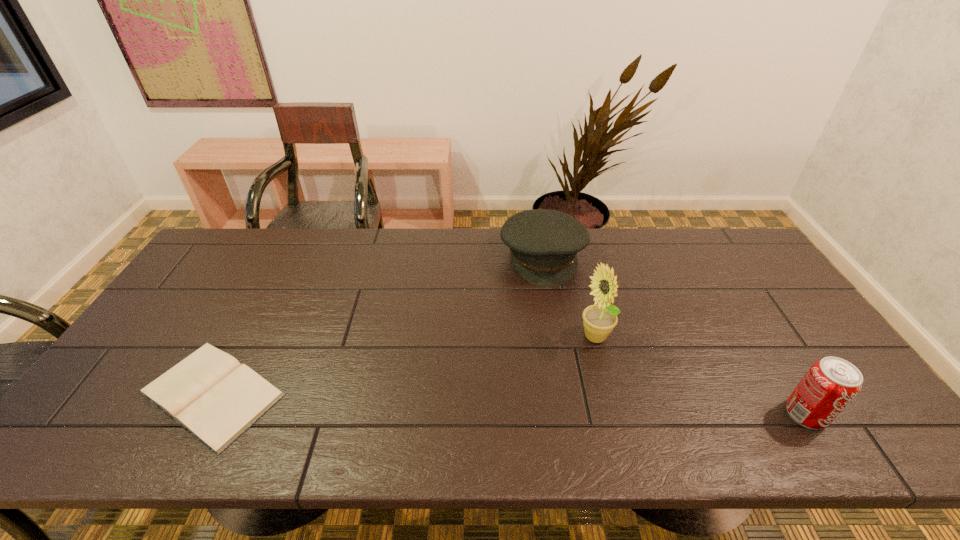
This screenshot has width=960, height=540. In order to click on object at the near left corner in this screenshot , I will do `click(213, 396)`.

Identify the location of object that is at the near right corner. The image size is (960, 540). (831, 383).

Locate an element on the screen. The width and height of the screenshot is (960, 540). blank space at the far edge of the desktop is located at coordinates (674, 266).

Where is `free space at the near edge of the desktop`? free space at the near edge of the desktop is located at coordinates (712, 406).

Where is `vacant space at the left edge`? The width and height of the screenshot is (960, 540). vacant space at the left edge is located at coordinates (156, 348).

In the image, there is a desktop. Where is `free space at the near left corner`? The height and width of the screenshot is (540, 960). free space at the near left corner is located at coordinates (103, 411).

At what (x,y) coordinates should I click in order to perform the action: click on free spot between the leftmost object and the beret. Please return your answer as a coordinate pair (x, y). Looking at the image, I should click on (377, 325).

Identify the location of free space between the second tallest object and the tallest object. (701, 376).

At what (x,y) coordinates should I click in order to perform the action: click on free spot between the shortest object and the beret. Please return your answer as a coordinate pair (x, y). This screenshot has width=960, height=540. Looking at the image, I should click on (377, 325).

You are a GUI agent. You are given a task and a screenshot of the screen. Output one action in this format:
    pyautogui.click(x=<x>, y=<y>)
    Task: Click on the vacant region between the second shortest object and the leftmost object
    
    Given the screenshot: What is the action you would take?
    pyautogui.click(x=377, y=325)